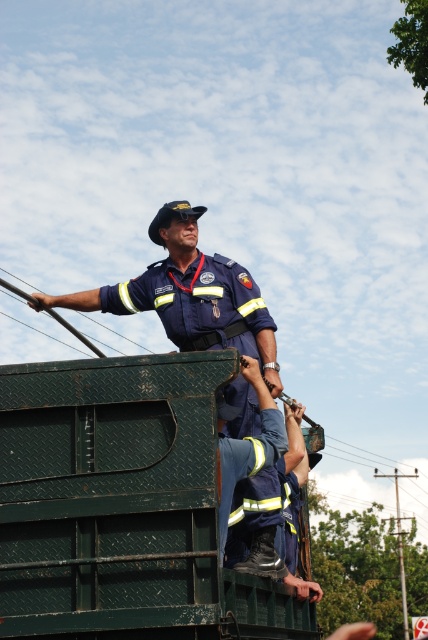
Question: Observing the image, what is the correct spatial positioning of green diamond plate garbage truck at upper center in reference to navy blue uniform at upper center?

Choices:
 (A) above
 (B) below

Answer: (B)

Question: Can you confirm if green diamond plate garbage truck at upper center is wider than navy blue uniform at upper center?

Choices:
 (A) yes
 (B) no

Answer: (B)

Question: Considering the relative positions of green diamond plate garbage truck at upper center and navy blue uniform at upper center in the image provided, where is green diamond plate garbage truck at upper center located with respect to navy blue uniform at upper center?

Choices:
 (A) above
 (B) below

Answer: (B)

Question: Which object is closer to the camera taking this photo?

Choices:
 (A) green diamond plate garbage truck at upper center
 (B) navy blue uniform at upper center

Answer: (A)

Question: Which of the following is the closest to the observer?

Choices:
 (A) (136, 300)
 (B) (41, 449)

Answer: (B)